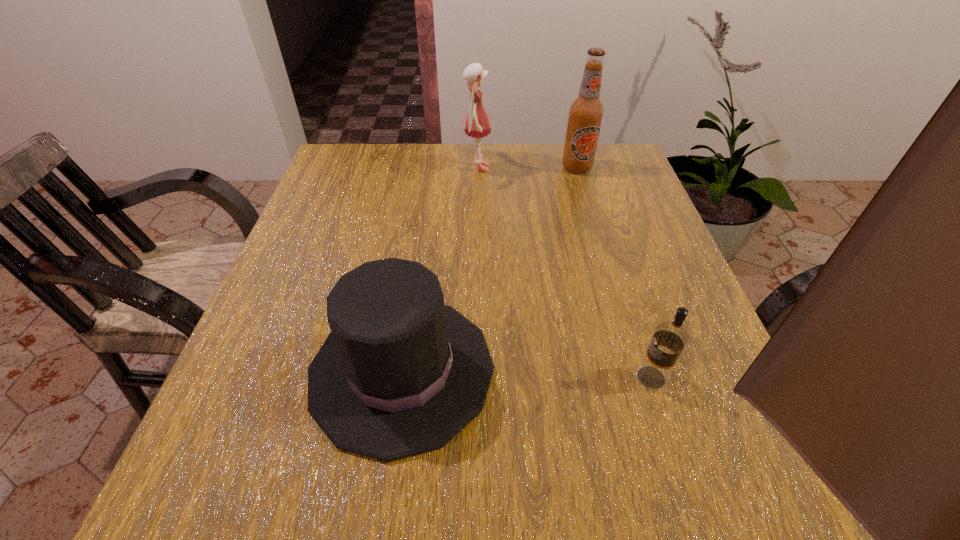
You are a GUI agent. You are given a task and a screenshot of the screen. Output one action in this format:
    pyautogui.click(x=<x>, y=<y>)
    Task: Click on the vacant space at the left edge of the desktop
    
    Given the screenshot: What is the action you would take?
    pyautogui.click(x=272, y=366)

At what (x,y) coordinates should I click in order to perform the action: click on vacant area at the right edge of the desktop. Please return your answer as a coordinate pair (x, y). Image resolution: width=960 pixels, height=540 pixels. Looking at the image, I should click on (695, 333).

Identify the location of free space at the far left corner. The image size is (960, 540). (343, 168).

Identify the location of blank space at the far right corner. (629, 165).

This screenshot has height=540, width=960. Identify the location of vacant space that's between the beer bottle and the vodka. (614, 273).

What are the coordinates of `vacant region between the vodka and the beer bottle` in the screenshot? It's located at (614, 273).

At what (x,y) coordinates should I click in order to perform the action: click on free spot between the vodka and the doll. Please return your answer as a coordinate pair (x, y). The height and width of the screenshot is (540, 960). Looking at the image, I should click on [564, 273].

Where is `free space between the dress hat and the doll`? Image resolution: width=960 pixels, height=540 pixels. free space between the dress hat and the doll is located at coordinates (440, 269).

You are a GUI agent. You are given a task and a screenshot of the screen. Output one action in this format:
    pyautogui.click(x=<x>, y=<y>)
    Task: Click on the free space between the vodka and the dress hat
    The width and height of the screenshot is (960, 540).
    Given the screenshot: What is the action you would take?
    pyautogui.click(x=526, y=374)

Locate an element on the screen. vacant space in between the dress hat and the doll is located at coordinates coord(440,269).